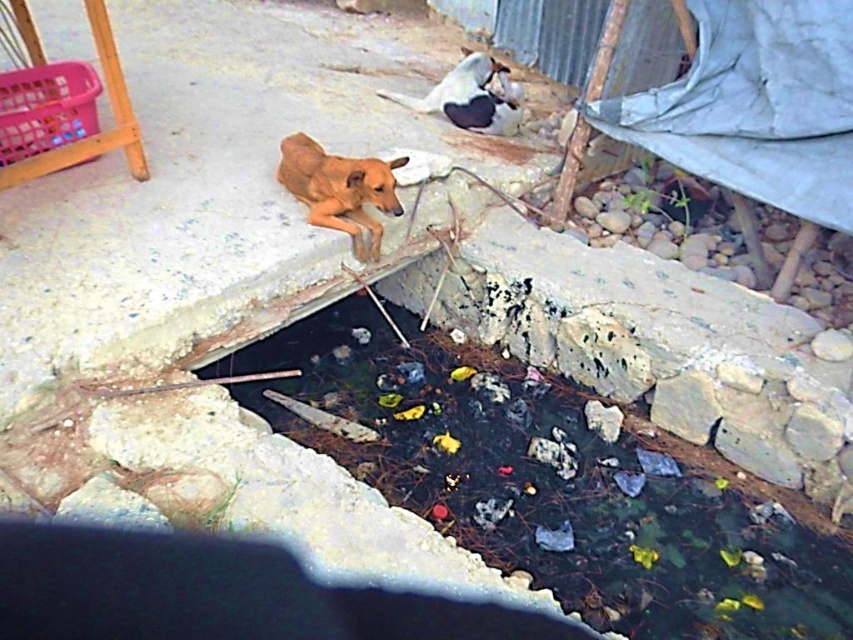
You are a dog owner who wants to ensure your white fur dog at upper center stays dry. Given the presence of the black stone puddle at center, which is larger, can you determine if the puddle is big enough to get the dog wet if it walks towards it?

The black stone puddle at center is larger than the white fur dog at upper center, so if the dog approaches it, there is a higher risk of the puddle being big enough to get the dog wet.

You are standing in the outdoor scene and want to avoid stepping into the black stone puddle at center. Which direction should you move to stay away from the puddle while staying near the brown furry dog at center?

Since the black stone puddle at center is closer to you than the brown furry dog at center, you should move backward away from the puddle to stay near the dog.

You are a hiker who has spotted both the brown furry dog at center and the white fur dog at upper center in the image. Which dog is positioned closer to the left side of the scene?

The brown furry dog at center is positioned to the left of the white fur dog at upper center, so the brown furry dog at center is closer to the left side of the scene.